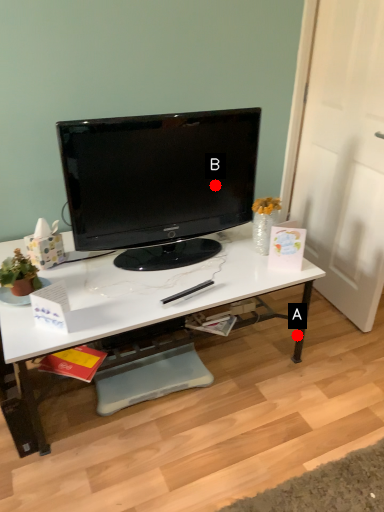
Question: Two points are circled on the image, labeled by A and B beside each circle. Which point is closer to the camera?

Choices:
 (A) A is closer
 (B) B is closer

Answer: (B)